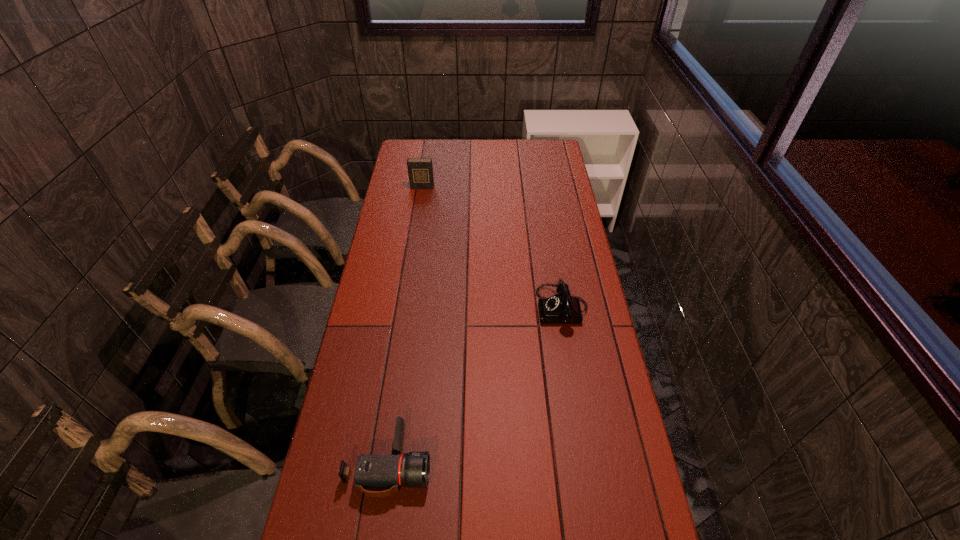
Locate an element on the screen. The width and height of the screenshot is (960, 540). vacant position located on the lens of the camcorder is located at coordinates (462, 463).

The height and width of the screenshot is (540, 960). In order to click on diary located at the left edge in this screenshot , I will do `click(420, 170)`.

Locate an element on the screen. The height and width of the screenshot is (540, 960). camcorder present at the left edge is located at coordinates (372, 472).

Locate an element on the screen. The image size is (960, 540). object that is at the right edge is located at coordinates (562, 308).

Image resolution: width=960 pixels, height=540 pixels. I want to click on free space at the far edge of the desktop, so click(x=506, y=146).

Find the location of a particular element. vacant region at the left edge is located at coordinates (347, 521).

In the image, there is a desktop. Identify the location of blank space at the right edge. (571, 373).

Locate an element on the screen. The image size is (960, 540). free space at the far right corner is located at coordinates (539, 163).

This screenshot has width=960, height=540. What are the coordinates of `free space between the farthest object and the second shortest object` in the screenshot? It's located at (492, 248).

This screenshot has width=960, height=540. Find the location of `free space between the rightmost object and the nearest object`. free space between the rightmost object and the nearest object is located at coordinates (476, 386).